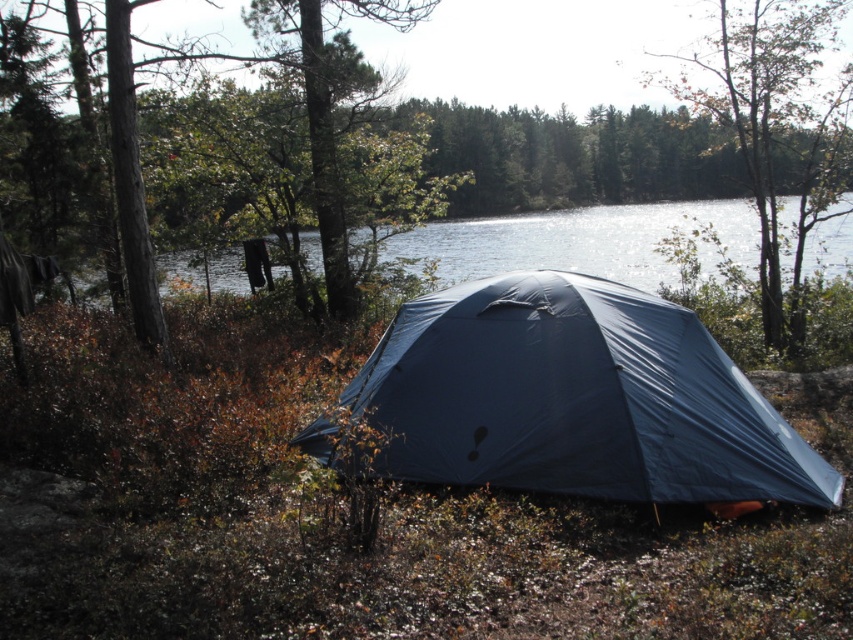
You are planning to set up a small campfire between the brown wood tree at center and the transparent blue water at center. Based on their widths, which object should you place the fire closer to in order to ensure it doesn

The brown wood tree at center is wider than the transparent blue water at center, so you should place the campfire closer to the transparent blue water at center to maintain a safe distance from the wider tree.

You are a hiker who wants to take a photo of the brown wood tree at center from the tent. Based on the scene, where should you position yourself relative to the tent to capture the tree in the center of your photo?

To capture the brown wood tree at center in the photo, you should position yourself at point (576, 156) relative to the tent.